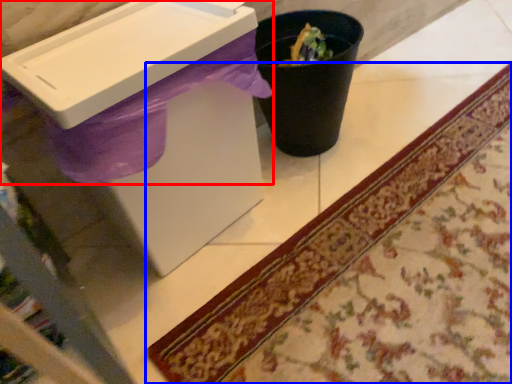
Question: Among these objects, which one is nearest to the camera, sink (highlighted by a red box) or mat (highlighted by a blue box)?

Choices:
 (A) sink
 (B) mat

Answer: (B)